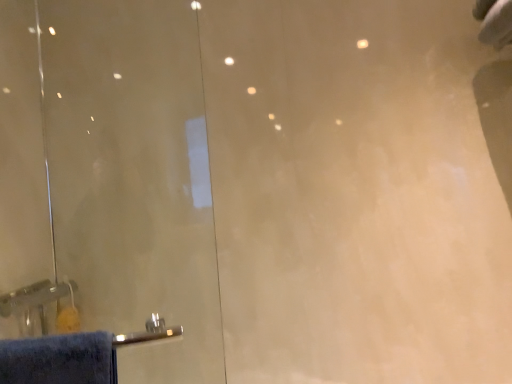
Measure the distance between transparent glass screen door at left and camera.

transparent glass screen door at left and camera are 37.70 inches apart.

Describe the element at coordinates (108, 183) in the screenshot. I see `transparent glass screen door at left` at that location.

Locate an element on the screen. This screenshot has width=512, height=384. transparent glass screen door at left is located at coordinates (108, 183).

This screenshot has height=384, width=512. What are the coordinates of `transparent glass screen door at left` in the screenshot? It's located at click(x=108, y=183).